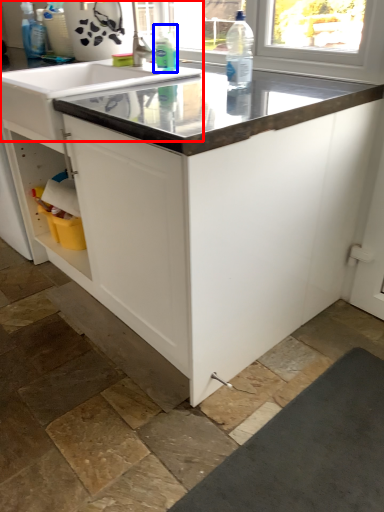
Question: Which point is closer to the camera, sink (highlighted by a red box) or cleaning product (highlighted by a blue box)?

Choices:
 (A) sink
 (B) cleaning product

Answer: (A)